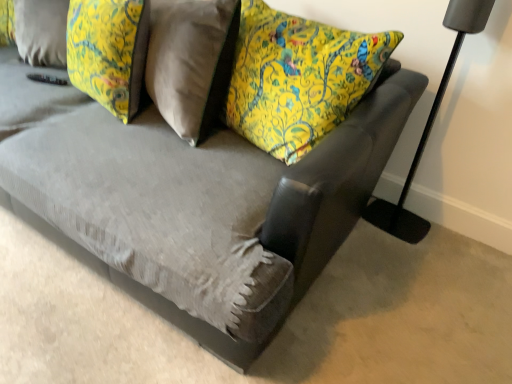
Find the location of `free spot below matte black floor lamp at right (from a real-world perspective)`. free spot below matte black floor lamp at right (from a real-world perspective) is located at coordinates (392, 223).